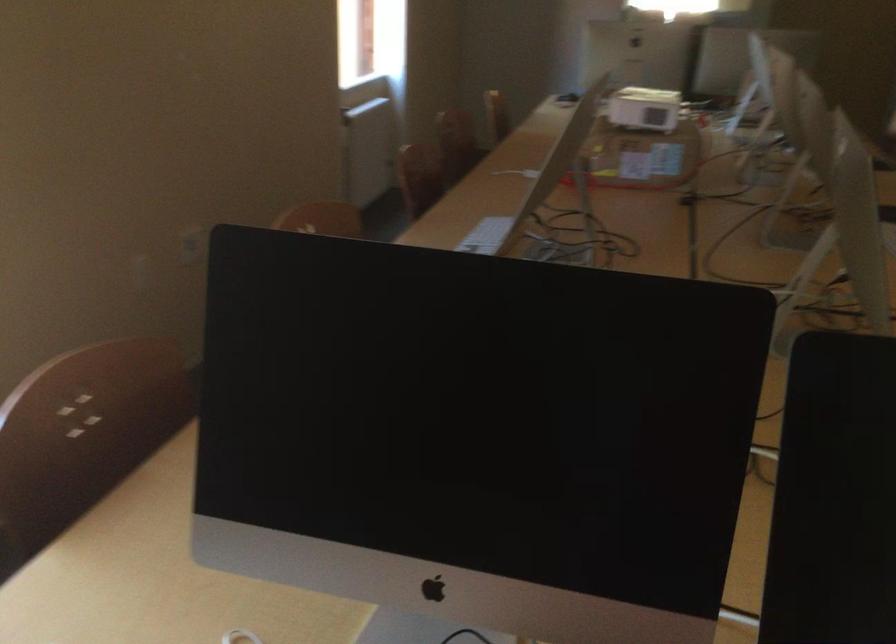
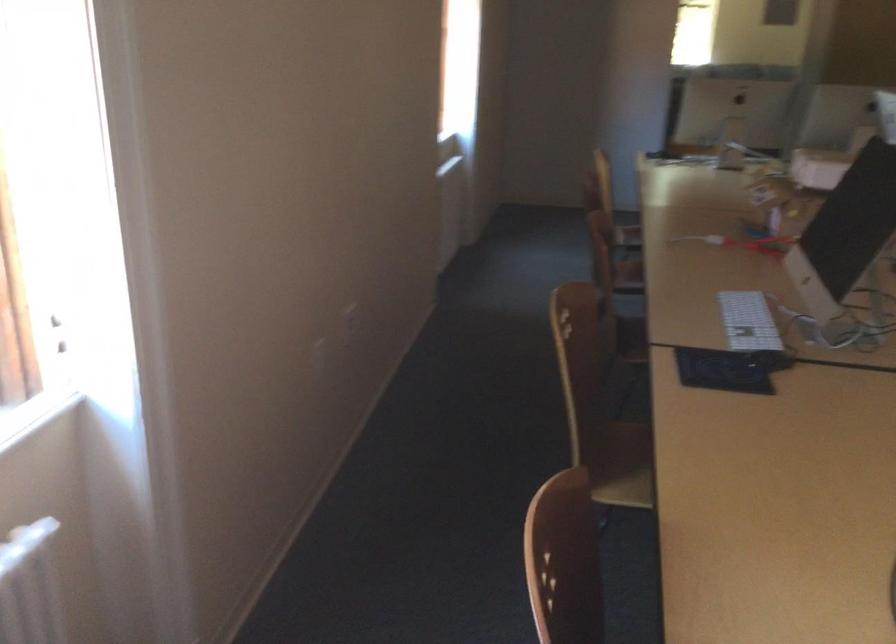
Question: In a continuous first-person perspective shot, in which direction is the camera moving?

Choices:
 (A) Left
 (B) Right
 (C) Forward
 (D) Backward

Answer: (A)